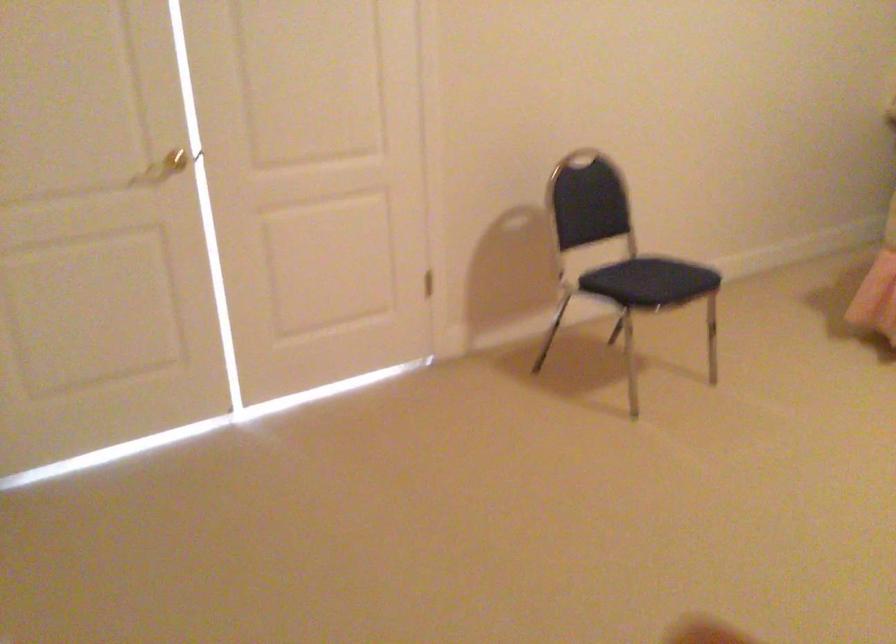
Describe the element at coordinates (657, 276) in the screenshot. I see `a black chair sitting surface` at that location.